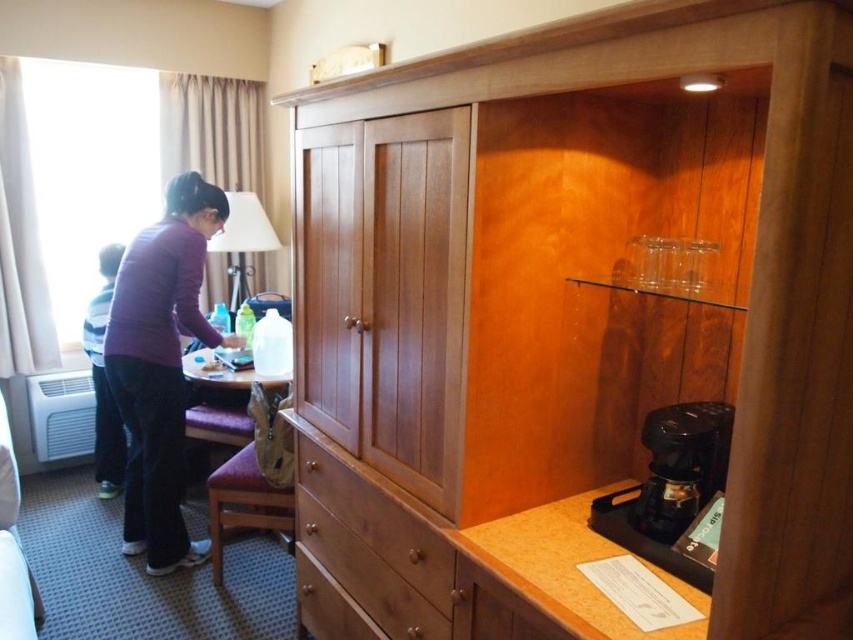
Which is more to the right, wooden dresser at center or black plastic coffee machine at lower right?

Positioned to the right is black plastic coffee machine at lower right.

Who is more distant from viewer, (775, 307) or (712, 460)?

Point (712, 460)

The width and height of the screenshot is (853, 640). Find the location of `wooden dresser at center`. wooden dresser at center is located at coordinates (572, 317).

Does wooden dresser at center have a greater width compared to purple fabric stool at lower center?

Yes.

Can you confirm if wooden dresser at center is positioned below purple fabric stool at lower center?

Incorrect, wooden dresser at center is not positioned below purple fabric stool at lower center.

Does point (749, 141) lie in front of point (289, 504)?

Yes, it is.

The height and width of the screenshot is (640, 853). Find the location of `wooden dresser at center`. wooden dresser at center is located at coordinates (572, 317).

Is purple cotton shirt at left below black plastic coffee machine at lower right?

No.

Can you confirm if purple cotton shirt at left is positioned above black plastic coffee machine at lower right?

Correct, purple cotton shirt at left is located above black plastic coffee machine at lower right.

Who is more distant from viewer, (154, 509) or (668, 477)?

Positioned behind is point (154, 509).

Locate an element on the screen. The image size is (853, 640). purple cotton shirt at left is located at coordinates (161, 365).